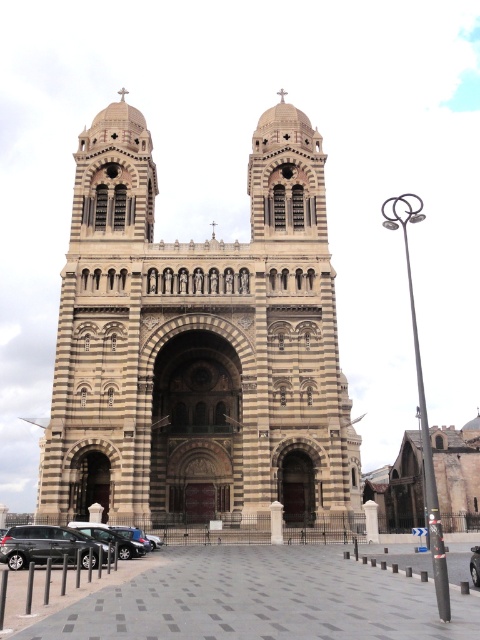
You are a delivery person needing to park a 15 feet long truck between the metallic silver car at lower left and the shiny black sedan at lower left. Can you fit the truck in that space?

The distance between the metallic silver car at lower left and the shiny black sedan at lower left is 19.51 feet, which is more than enough to accommodate a 15 feet long truck.

You are standing at the entrance of the grand cathedral and notice a metallic silver car at lower left. Can you determine if the car is positioned to the left or right side of the cathedral?

The metallic silver car at lower left is positioned to the left side of the cathedral as it is located at point (47, 547) which places it on the left side in the lower area.